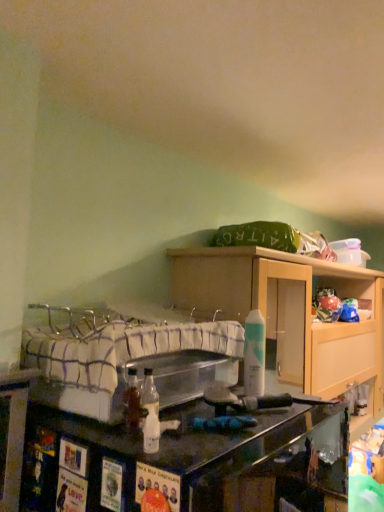
Question: From the image's perspective, is matte wood cabinet at upper center below white matte spray can at center?

Choices:
 (A) no
 (B) yes

Answer: (B)

Question: Is matte wood cabinet at upper center wider than white matte spray can at center?

Choices:
 (A) yes
 (B) no

Answer: (A)

Question: Is matte wood cabinet at upper center positioned before white matte spray can at center?

Choices:
 (A) yes
 (B) no

Answer: (B)

Question: Is matte wood cabinet at upper center aimed at white matte spray can at center?

Choices:
 (A) no
 (B) yes

Answer: (A)

Question: Can you confirm if matte wood cabinet at upper center is shorter than white matte spray can at center?

Choices:
 (A) no
 (B) yes

Answer: (A)

Question: Does matte wood cabinet at upper center have a smaller size compared to white matte spray can at center?

Choices:
 (A) no
 (B) yes

Answer: (A)

Question: Can you confirm if white matte spray can at center is thinner than plaid fabric bed at center?

Choices:
 (A) yes
 (B) no

Answer: (A)

Question: Is white matte spray can at center behind plaid fabric bed at center?

Choices:
 (A) no
 (B) yes

Answer: (B)

Question: Considering the relative sizes of white matte spray can at center and plaid fabric bed at center in the image provided, is white matte spray can at center smaller than plaid fabric bed at center?

Choices:
 (A) no
 (B) yes

Answer: (B)

Question: From the image's perspective, would you say white matte spray can at center is positioned over plaid fabric bed at center?

Choices:
 (A) no
 (B) yes

Answer: (B)

Question: Is white matte spray can at center taller than plaid fabric bed at center?

Choices:
 (A) no
 (B) yes

Answer: (B)

Question: Is white matte spray can at center not near plaid fabric bed at center?

Choices:
 (A) yes
 (B) no

Answer: (B)

Question: Can you confirm if plaid fabric bed at center is thinner than white matte spray can at center?

Choices:
 (A) yes
 (B) no

Answer: (B)